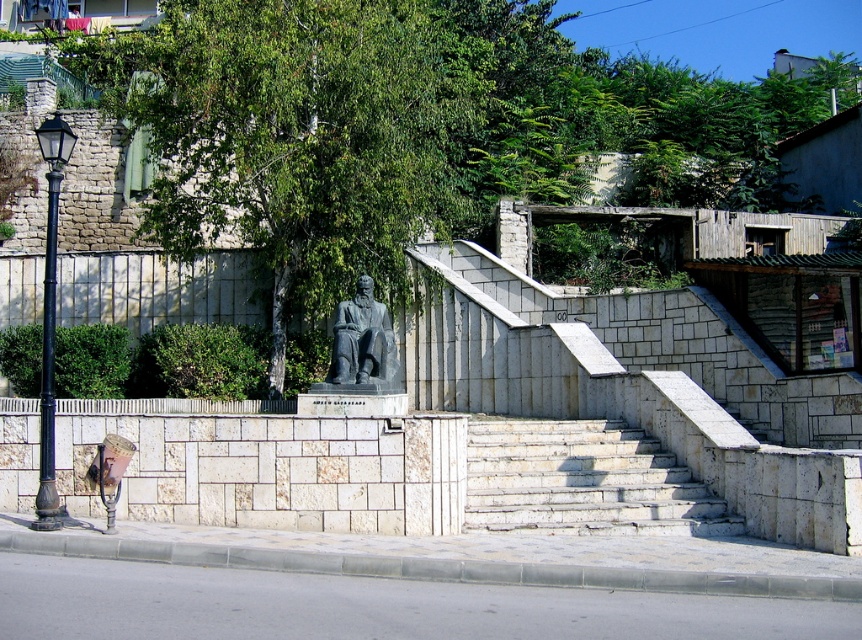
Question: Does green leafy tree at center come in front of gray stone statue at center?

Choices:
 (A) yes
 (B) no

Answer: (B)

Question: Which object appears farthest from the camera in this image?

Choices:
 (A) gray stone statue at center
 (B) green leafy tree at center
 (C) white stone stairs at center

Answer: (B)

Question: Can you confirm if green leafy tree at center is bigger than white stone stairs at center?

Choices:
 (A) no
 (B) yes

Answer: (B)

Question: Considering the real-world distances, which object is farthest from the green leafy tree at center?

Choices:
 (A) gray stone statue at center
 (B) white stone stairs at center

Answer: (A)

Question: Which object is farther from the camera taking this photo?

Choices:
 (A) gray stone statue at center
 (B) green leafy tree at center
 (C) white stone stairs at center

Answer: (B)

Question: Does white stone stairs at center have a larger size compared to gray stone statue at center?

Choices:
 (A) no
 (B) yes

Answer: (B)